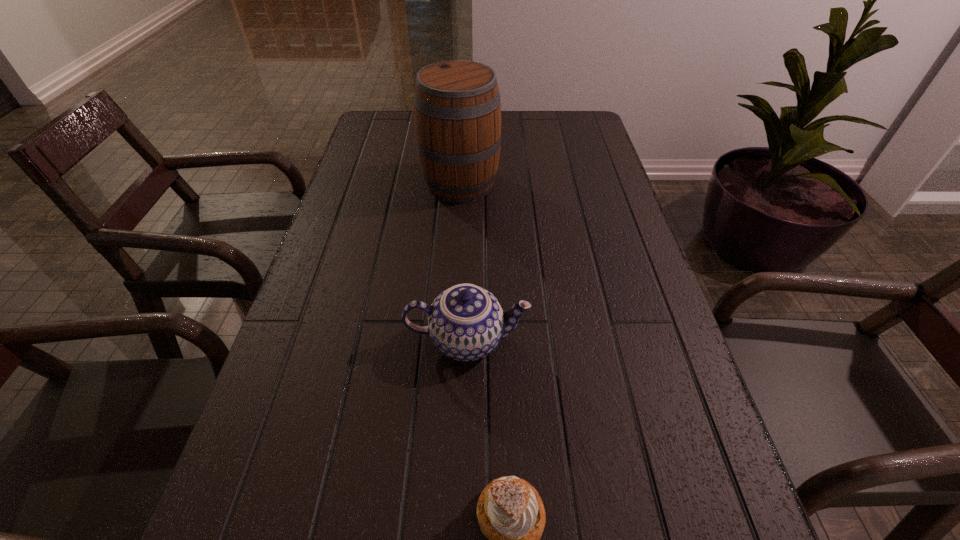
Identify the location of vacant space in between the farthest object and the chinaware. (464, 261).

I want to click on free area in between the chinaware and the cider, so click(x=464, y=261).

I want to click on vacant area between the chinaware and the farthest object, so 464,261.

You are a GUI agent. You are given a task and a screenshot of the screen. Output one action in this format:
    pyautogui.click(x=<x>, y=<y>)
    Task: Click on the empty space that is in between the farthest object and the chinaware
    This screenshot has width=960, height=540.
    Given the screenshot: What is the action you would take?
    (x=464, y=261)

This screenshot has height=540, width=960. Find the location of `empty space between the tallest object and the second tallest object`. empty space between the tallest object and the second tallest object is located at coordinates (464, 261).

Identify the location of the second closest object to the second tallest object. (457, 109).

Choose which object is the second nearest neighbor to the second nearest object. Please provide its 2D coordinates. Your answer should be formatted as a tuple, i.e. [(x, y)], where the tuple contains the x and y coordinates of a point satisfying the conditions above.

[(457, 109)]